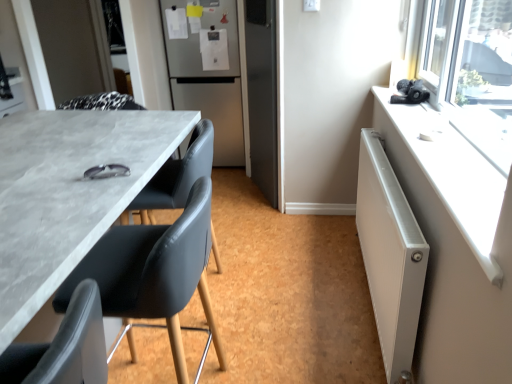
Question: Does black leather chair at lower left, which appears as the 3th chair when viewed from the back, have a greater width compared to matte black chair at center, which appears as the third chair when viewed from the front?

Choices:
 (A) yes
 (B) no

Answer: (B)

Question: Is matte black chair at center, which appears as the third chair when viewed from the front, at the back of black leather chair at lower left, which appears as the 3th chair when viewed from the back?

Choices:
 (A) no
 (B) yes

Answer: (A)

Question: Is black leather chair at lower left, the 1th chair when ordered from front to back, oriented towards matte black chair at center, which appears as the third chair when viewed from the front?

Choices:
 (A) yes
 (B) no

Answer: (B)

Question: From a real-world perspective, is black leather chair at lower left, which appears as the 3th chair when viewed from the back, located higher than matte black chair at center, which appears as the 1th chair when viewed from the back?

Choices:
 (A) no
 (B) yes

Answer: (B)

Question: Is the depth of black leather chair at lower left, the 1th chair when ordered from front to back, greater than that of matte black chair at center, which appears as the 1th chair when viewed from the back?

Choices:
 (A) yes
 (B) no

Answer: (B)

Question: Is point (122, 284) closer or farther from the camera than point (201, 165)?

Choices:
 (A) farther
 (B) closer

Answer: (B)

Question: In terms of width, does matte black chair at left, positioned as the second chair in front-to-back order, look wider or thinner when compared to matte black chair at center, which appears as the third chair when viewed from the front?

Choices:
 (A) thin
 (B) wide

Answer: (B)

Question: From the image's perspective, relative to matte black chair at center, which appears as the third chair when viewed from the front, is matte black chair at left, arranged as the 2th chair when viewed from the back, above or below?

Choices:
 (A) above
 (B) below

Answer: (B)

Question: From a real-world perspective, is matte black chair at left, positioned as the second chair in front-to-back order, above or below matte black chair at center, which appears as the third chair when viewed from the front?

Choices:
 (A) below
 (B) above

Answer: (A)

Question: Would you say matte black chair at center, which appears as the third chair when viewed from the front, is inside or outside satin silver refrigerator at center?

Choices:
 (A) outside
 (B) inside

Answer: (A)

Question: Considering the positions of matte black chair at center, which appears as the 1th chair when viewed from the back, and satin silver refrigerator at center in the image, is matte black chair at center, which appears as the 1th chair when viewed from the back, taller or shorter than satin silver refrigerator at center?

Choices:
 (A) tall
 (B) short

Answer: (B)

Question: Based on their positions, is matte black chair at center, which appears as the third chair when viewed from the front, located to the left or right of satin silver refrigerator at center?

Choices:
 (A) left
 (B) right

Answer: (A)

Question: From a real-world perspective, is matte black chair at center, which appears as the 1th chair when viewed from the back, above or below satin silver refrigerator at center?

Choices:
 (A) below
 (B) above

Answer: (A)

Question: Is point (432, 175) closer or farther from the camera than point (411, 359)?

Choices:
 (A) farther
 (B) closer

Answer: (B)

Question: Is white plastic radiator at upper right to the left or to the right of white metallic radiator at right in the image?

Choices:
 (A) right
 (B) left

Answer: (A)